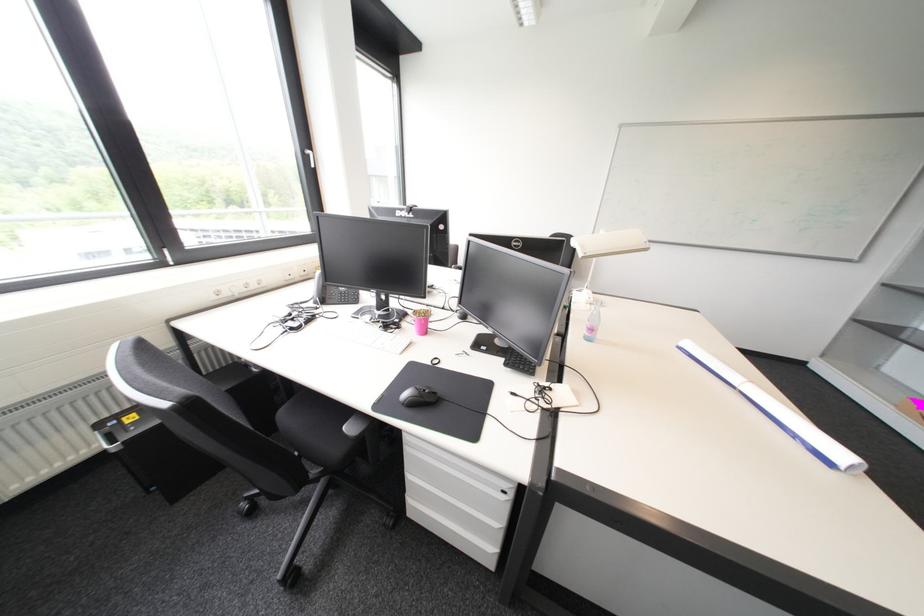
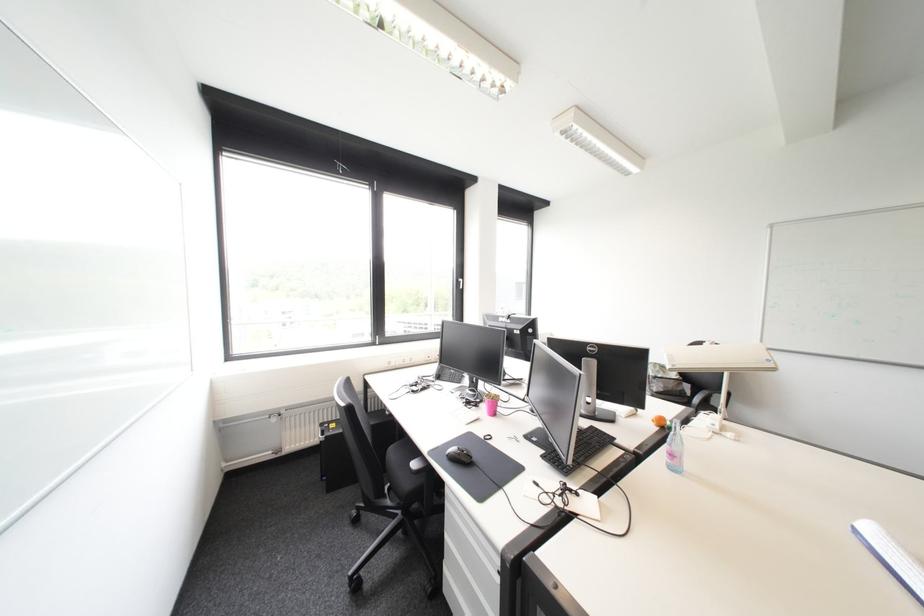
Where in the second image is the point corresponding to point 432,400 from the first image?

(468, 458)